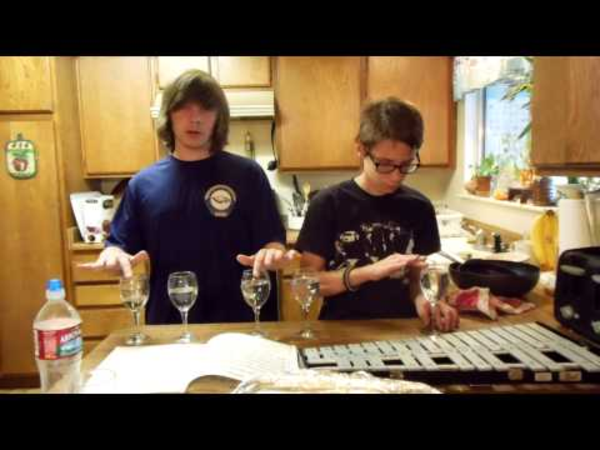
Where is `glass`? This screenshot has width=600, height=450. glass is located at coordinates (132, 299), (183, 300), (253, 290), (305, 299), (436, 286).